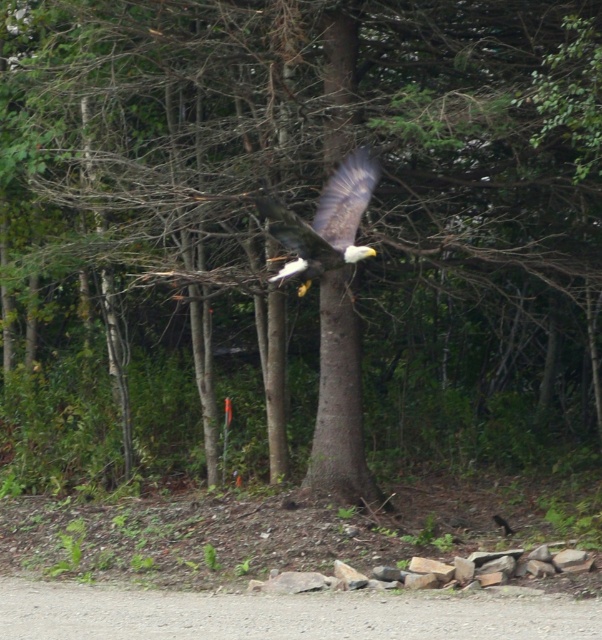
Question: Can you confirm if brown rough tree trunk at center is positioned to the right of dark brown feathers at center?

Choices:
 (A) yes
 (B) no

Answer: (A)

Question: Can you confirm if brown rough tree trunk at center is positioned above dark brown feathers at center?

Choices:
 (A) yes
 (B) no

Answer: (B)

Question: Among these objects, which one is farthest from the camera?

Choices:
 (A) dark brown feathers at center
 (B) brown rough tree trunk at center

Answer: (B)

Question: Among these objects, which one is nearest to the camera?

Choices:
 (A) brown rough tree trunk at center
 (B) dark brown feathers at center

Answer: (B)

Question: Which point appears closest to the camera in this image?

Choices:
 (A) (352, 138)
 (B) (329, 241)

Answer: (B)

Question: Does brown rough tree trunk at center lie in front of dark brown feathers at center?

Choices:
 (A) yes
 (B) no

Answer: (B)